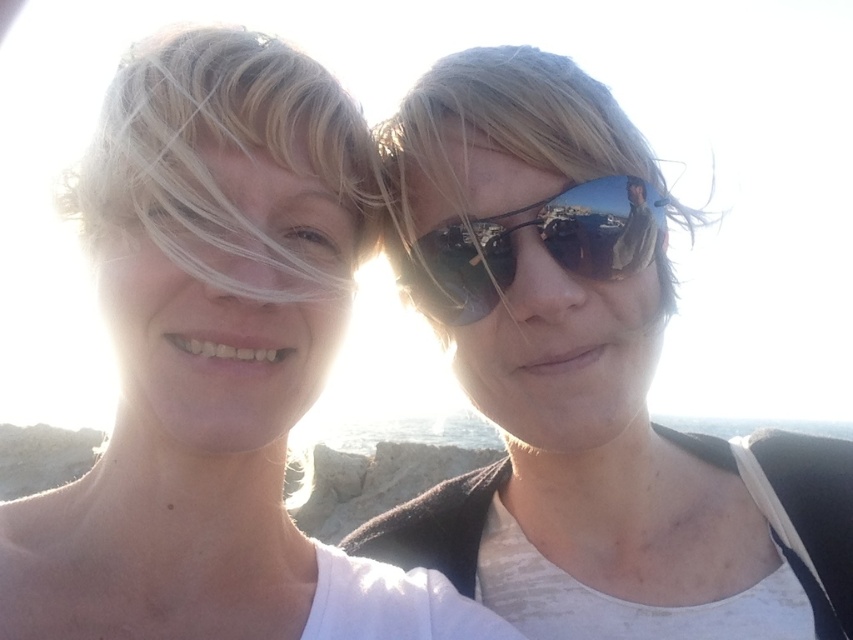
Is blonde hair at left closer to camera compared to blonde hair at upper right?

Yes, blonde hair at left is closer to the viewer.

Is point (158, 204) positioned after point (404, 205)?

That is False.

Identify the location of blonde hair at left. click(227, 148).

Between point (477, 369) and point (489, 99), which one is positioned behind?

Positioned behind is point (477, 369).

This screenshot has width=853, height=640. In order to click on matte black sunglasses at center in this screenshot , I will do `click(585, 381)`.

Does point (427, 97) come behind point (561, 64)?

No, (427, 97) is closer to viewer.

At what (x,y) coordinates should I click in order to perform the action: click on matte black sunglasses at center. Please return your answer as a coordinate pair (x, y). Looking at the image, I should click on (585, 381).

Is blonde hair at upper right taller than sunglasses at right?

Yes.

Where is `blonde hair at upper right`? The height and width of the screenshot is (640, 853). blonde hair at upper right is located at coordinates (508, 124).

Between point (682, 220) and point (645, 240), which one is positioned in front?

Point (645, 240) is in front.

Where is `blonde hair at upper right`? The height and width of the screenshot is (640, 853). blonde hair at upper right is located at coordinates (508, 124).